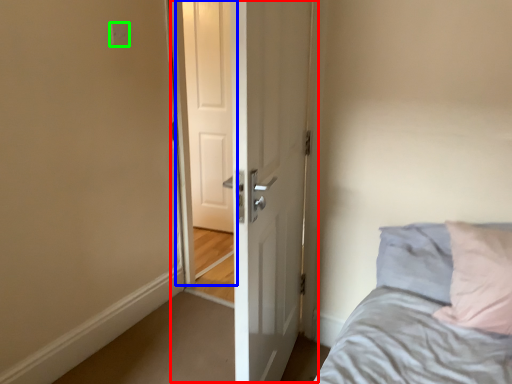
Question: Estimate the real-world distances between objects in this image. Which object is farther from door (highlighted by a red box), screen door (highlighted by a blue box) or electric outlet (highlighted by a green box)?

Choices:
 (A) screen door
 (B) electric outlet

Answer: (A)